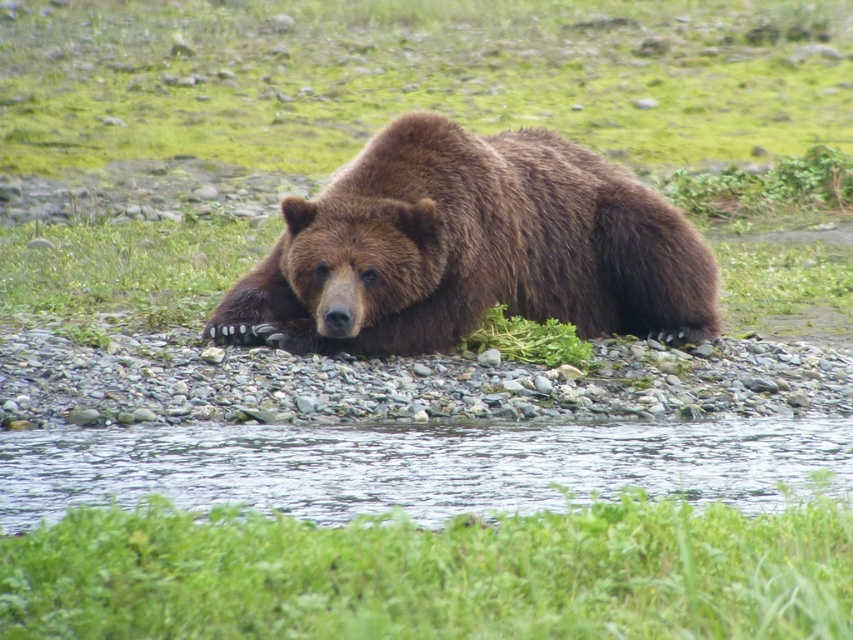
Question: Is brown furry bear at center positioned behind clear water at center?

Choices:
 (A) no
 (B) yes

Answer: (B)

Question: Does green leafy grass at lower center have a lesser width compared to clear water at center?

Choices:
 (A) no
 (B) yes

Answer: (B)

Question: Which point appears farthest from the camera in this image?

Choices:
 (A) pyautogui.click(x=444, y=547)
 (B) pyautogui.click(x=357, y=211)
 (C) pyautogui.click(x=463, y=432)

Answer: (B)

Question: Observing the image, what is the correct spatial positioning of brown furry bear at center in reference to clear water at center?

Choices:
 (A) below
 (B) above

Answer: (B)

Question: Which point appears closest to the camera in this image?

Choices:
 (A) (x=268, y=260)
 (B) (x=705, y=499)
 (C) (x=3, y=616)

Answer: (C)

Question: Which object appears farthest from the camera in this image?

Choices:
 (A) brown furry bear at center
 (B) green leafy grass at lower center

Answer: (A)